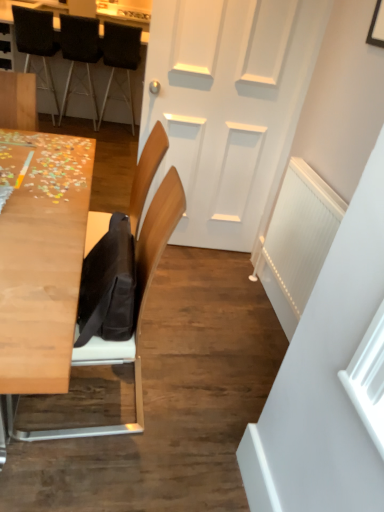
Question: Could you tell me if dark brown leather chair at upper left, which is counted as the 3th chair, starting from the back, is facing wooden puzzle pieces at upper left, which ranks as the second table in bottom-to-top order?

Choices:
 (A) yes
 (B) no

Answer: (A)

Question: Considering the relative sizes of dark brown leather chair at upper left, the 2th chair from the front, and wooden puzzle pieces at upper left, marked as the 2th table in a front-to-back arrangement, in the image provided, is dark brown leather chair at upper left, the 2th chair from the front, smaller than wooden puzzle pieces at upper left, marked as the 2th table in a front-to-back arrangement,?

Choices:
 (A) no
 (B) yes

Answer: (B)

Question: Is dark brown leather chair at upper left, the 2th chair from the front, further to the viewer compared to wooden puzzle pieces at upper left, which ranks as the second table in bottom-to-top order?

Choices:
 (A) yes
 (B) no

Answer: (B)

Question: Is wooden puzzle pieces at upper left, which ranks as the second table in bottom-to-top order, at the back of dark brown leather chair at upper left, which is counted as the 3th chair, starting from the back?

Choices:
 (A) yes
 (B) no

Answer: (A)

Question: Is dark brown leather chair at upper left, which is counted as the 3th chair, starting from the back, surrounding wooden puzzle pieces at upper left, the 1th table when ordered from back to front?

Choices:
 (A) yes
 (B) no

Answer: (B)

Question: Considering the relative positions of wooden chair at left, which is counted as the 1th chair, starting from the front, and light wood table at left, the 1th table when ordered from front to back, in the image provided, is wooden chair at left, which is counted as the 1th chair, starting from the front, to the left or to the right of light wood table at left, the 1th table when ordered from front to back,?

Choices:
 (A) left
 (B) right

Answer: (B)

Question: Is wooden chair at left, which is counted as the fourth chair, starting from the back, taller or shorter than light wood table at left, the 2th table viewed from the top?

Choices:
 (A) short
 (B) tall

Answer: (B)

Question: Is point (139, 306) positioned closer to the camera than point (52, 308)?

Choices:
 (A) closer
 (B) farther

Answer: (B)

Question: From the image's perspective, is wooden chair at left, which is counted as the fourth chair, starting from the back, positioned above or below light wood table at left, which appears as the 2th table when viewed from the back?

Choices:
 (A) below
 (B) above

Answer: (A)

Question: From a real-world perspective, relative to black fabric chair at upper left, positioned as the 2th chair in back-to-front order, is wooden chair at left, which is counted as the fourth chair, starting from the back, vertically above or below?

Choices:
 (A) below
 (B) above

Answer: (A)

Question: From the image's perspective, is wooden chair at left, which is counted as the fourth chair, starting from the back, above or below black fabric chair at upper left, positioned as the 2th chair in back-to-front order?

Choices:
 (A) above
 (B) below

Answer: (B)

Question: Would you say wooden chair at left, which is counted as the 1th chair, starting from the front, is to the left or to the right of black fabric chair at upper left, positioned as the 2th chair in back-to-front order, in the picture?

Choices:
 (A) right
 (B) left

Answer: (A)

Question: Is wooden chair at left, which is counted as the 1th chair, starting from the front, inside the boundaries of black fabric chair at upper left, positioned as the 2th chair in back-to-front order, or outside?

Choices:
 (A) outside
 (B) inside

Answer: (A)

Question: Is black fabric chair at upper left, positioned as the 2th chair in back-to-front order, bigger or smaller than dark brown leather chair at upper left, which is counted as the 3th chair, starting from the back?

Choices:
 (A) small
 (B) big

Answer: (A)

Question: From a real-world perspective, relative to dark brown leather chair at upper left, which is counted as the 3th chair, starting from the back, is black fabric chair at upper left, the third chair in the front-to-back sequence, vertically above or below?

Choices:
 (A) above
 (B) below

Answer: (B)